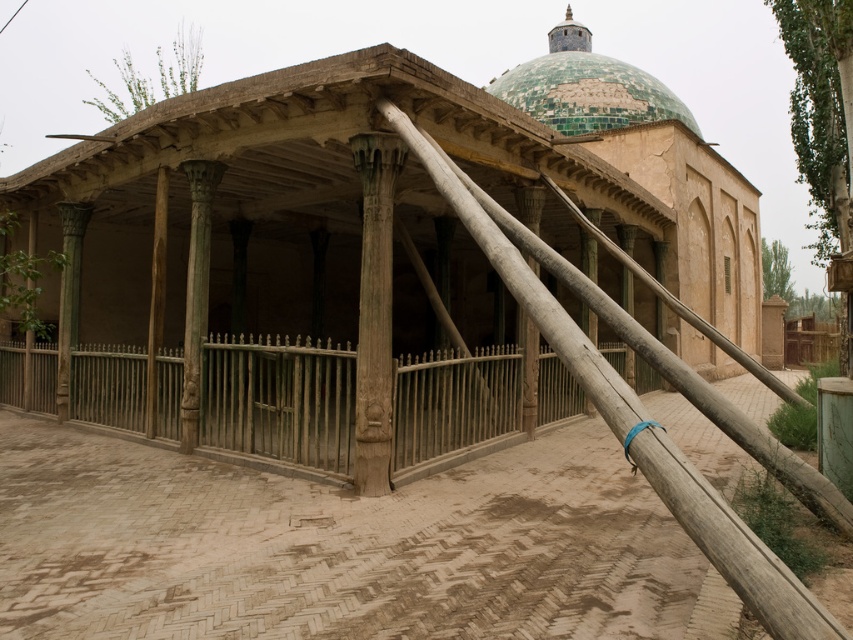
Question: Is wooden fence at center in front of greenish-brown wood column at center?

Choices:
 (A) no
 (B) yes

Answer: (A)

Question: Does wooden fence at center appear on the right side of greenish-brown wood column at center?

Choices:
 (A) no
 (B) yes

Answer: (A)

Question: Which object appears farthest from the camera in this image?

Choices:
 (A) greenish-brown wood column at center
 (B) wooden fence at center
 (C) green tiled dome at upper center
 (D) wooden hut at center

Answer: (C)

Question: Which of the following is the closest to the observer?

Choices:
 (A) (561, 26)
 (B) (366, 269)
 (C) (640, 113)
 (D) (482, 433)

Answer: (B)

Question: Is wooden fence at center below green tiled dome at upper center?

Choices:
 (A) yes
 (B) no

Answer: (A)

Question: Among these objects, which one is nearest to the camera?

Choices:
 (A) wooden hut at center
 (B) green tiled dome at upper center
 (C) greenish-brown wood column at center
 (D) wooden fence at center

Answer: (A)